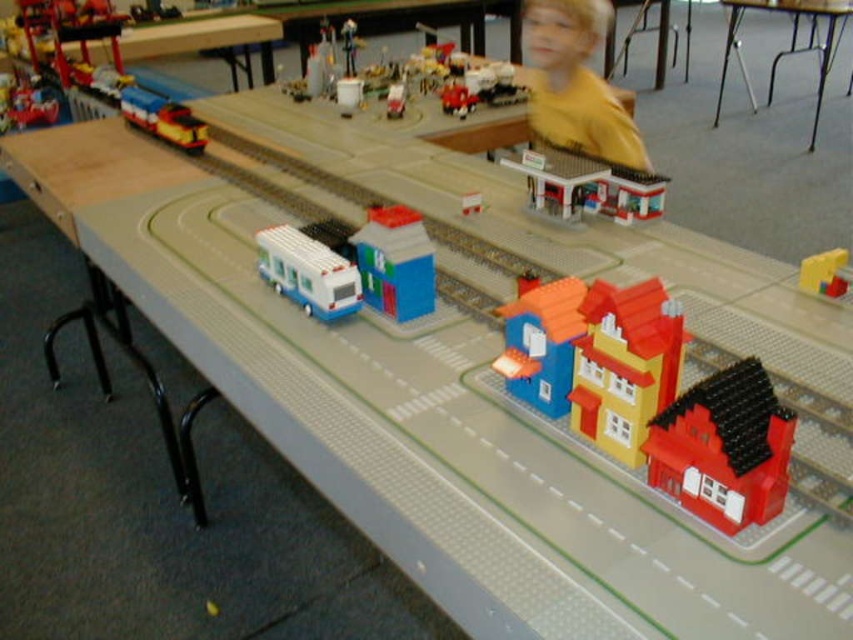
Question: Is brick yellow house at center above blue plastic house at center?

Choices:
 (A) yes
 (B) no

Answer: (B)

Question: Estimate the real-world distances between objects in this image. Which object is closer to the brick yellow house at center?

Choices:
 (A) metallic silver table at upper right
 (B) white plastic train at center
 (C) white plastic bus at center

Answer: (C)

Question: Which object is farther from the camera taking this photo?

Choices:
 (A) blue plastic house at center
 (B) white plastic bus at center
 (C) brick yellow house at center
 (D) brick red house at lower right

Answer: (B)

Question: Among these points, which one is farthest from the camera?

Choices:
 (A) (631, 392)
 (B) (532, 308)
 (C) (735, 465)

Answer: (B)

Question: Is brick red house at lower right below smooth plastic train at center?

Choices:
 (A) no
 (B) yes

Answer: (B)

Question: Can you confirm if brick-patterned house at center is positioned to the right of white plastic bus at center?

Choices:
 (A) yes
 (B) no

Answer: (A)